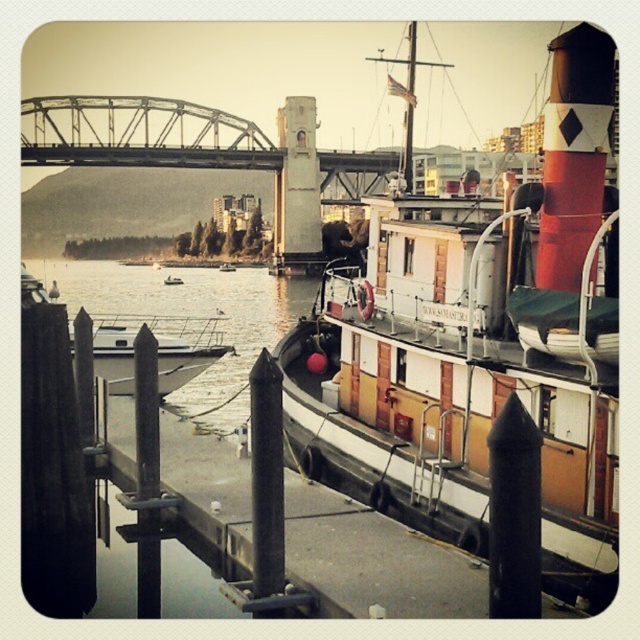
Can you confirm if wooden cabin cruiser at center is positioned below smooth concrete dock at center?

Actually, wooden cabin cruiser at center is above smooth concrete dock at center.

What do you see at coordinates (480, 348) in the screenshot? The height and width of the screenshot is (640, 640). I see `wooden cabin cruiser at center` at bounding box center [480, 348].

Locate an element on the screen. wooden cabin cruiser at center is located at coordinates (480, 348).

Can you confirm if wooden cabin cruiser at center is positioned to the right of white glossy boat at center?

Yes, wooden cabin cruiser at center is to the right of white glossy boat at center.

Does wooden cabin cruiser at center have a lesser width compared to white glossy boat at center?

Yes.

Measure the distance between point (365, 412) and camera.

The distance of point (365, 412) from camera is 27.80 meters.

Identify the location of wooden cabin cruiser at center. This screenshot has height=640, width=640. (480, 348).

Between wooden cabin cruiser at center and clear water at dock center, which one appears on the left side from the viewer's perspective?

clear water at dock center is more to the left.

Which is more to the right, wooden cabin cruiser at center or clear water at dock center?

Positioned to the right is wooden cabin cruiser at center.

Image resolution: width=640 pixels, height=640 pixels. What do you see at coordinates (480, 348) in the screenshot?
I see `wooden cabin cruiser at center` at bounding box center [480, 348].

You are a GUI agent. You are given a task and a screenshot of the screen. Output one action in this format:
    pyautogui.click(x=<x>, y=<y>)
    Task: Click on the wooden cabin cruiser at center
    Image resolution: width=640 pixels, height=640 pixels.
    Given the screenshot: What is the action you would take?
    pyautogui.click(x=480, y=348)